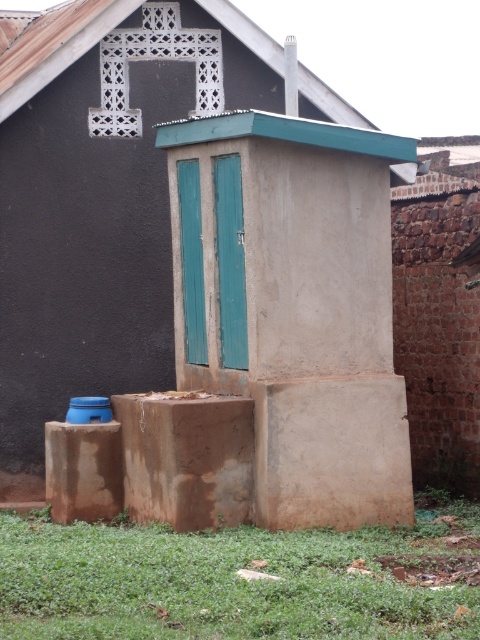
Question: Is brown mud hut at center smaller than green grass at lower center?

Choices:
 (A) yes
 (B) no

Answer: (A)

Question: Which object is farther from the camera taking this photo?

Choices:
 (A) brown mud hut at center
 (B) green grass at lower center

Answer: (A)

Question: Can you confirm if brown mud hut at center is smaller than green grass at lower center?

Choices:
 (A) yes
 (B) no

Answer: (A)

Question: Which point is farther to the camera?

Choices:
 (A) green grass at lower center
 (B) brown mud hut at center

Answer: (B)

Question: Can you confirm if brown mud hut at center is thinner than green grass at lower center?

Choices:
 (A) yes
 (B) no

Answer: (A)